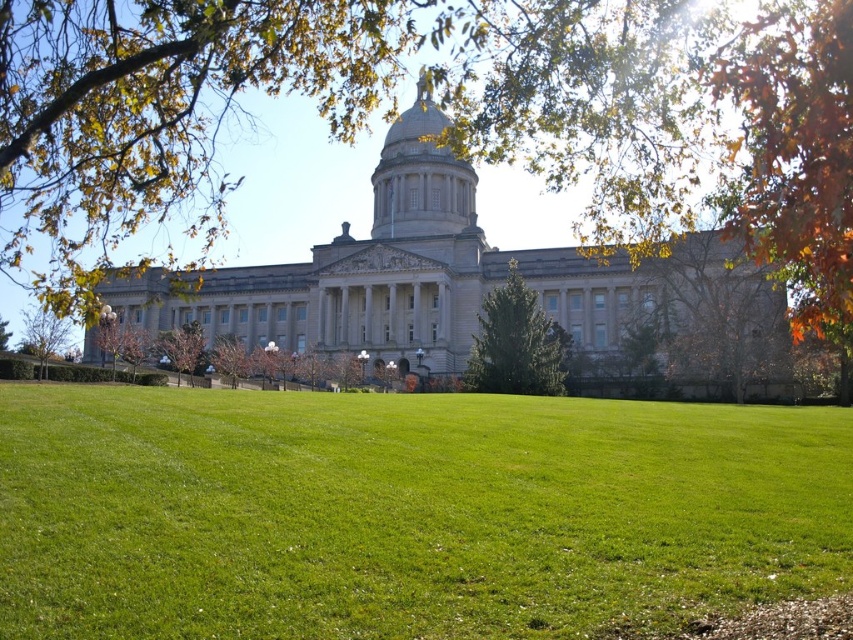
You are standing at the entrance of the grand neoclassical building and see two points marked on the lawn. The first point is at coordinates point (38, 349) and the second is at point (225, 356). Which point is closer to you?

Point (38, 349) is in front of point (225, 356), so the first point is closer to you.

What is the spatial relationship between the green textured tree at center and the green leafy tree at lower left?

The green textured tree at center is positioned to the right of the green leafy tree at lower left.